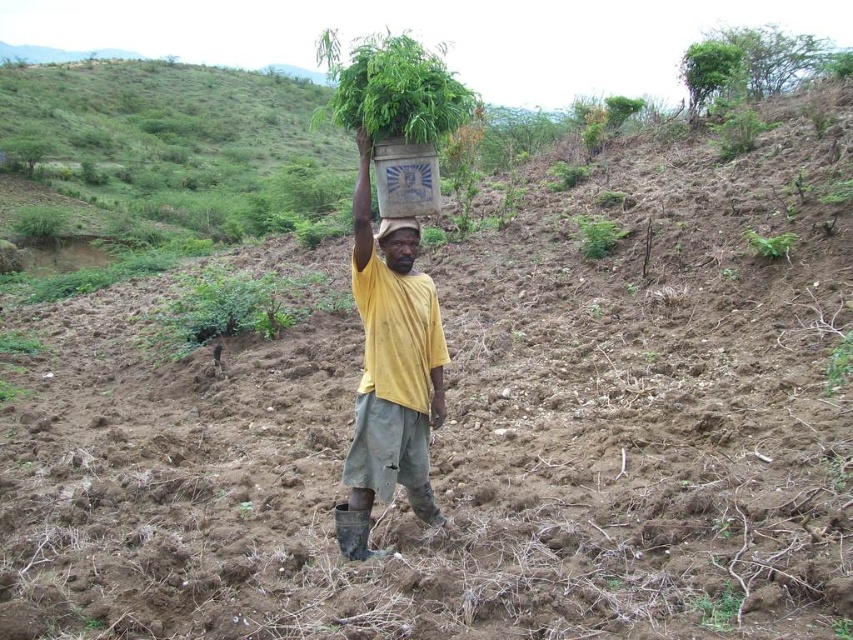
Does yellow fabric head at center have a lesser width compared to green leafy plant at upper right?

Yes, yellow fabric head at center is thinner than green leafy plant at upper right.

Is yellow fabric head at center to the right of green leafy plant at upper right from the viewer's perspective?

In fact, yellow fabric head at center is to the left of green leafy plant at upper right.

The height and width of the screenshot is (640, 853). In order to click on yellow fabric head at center in this screenshot , I will do `click(398, 243)`.

Is green leafy plant at center closer to the viewer compared to green leafy plant at upper right?

No, it is behind green leafy plant at upper right.

Find the location of a particular element. This screenshot has height=640, width=853. green leafy plant at center is located at coordinates (596, 236).

In order to click on yellow fabric head at center in this screenshot , I will do `click(398, 243)`.

Between yellow fabric head at center and green leafy plant at center, which one is positioned lower?

yellow fabric head at center is lower down.

Does point (415, 241) come behind point (607, 237)?

No, (415, 241) is in front of (607, 237).

Image resolution: width=853 pixels, height=640 pixels. I want to click on yellow fabric head at center, so click(398, 243).